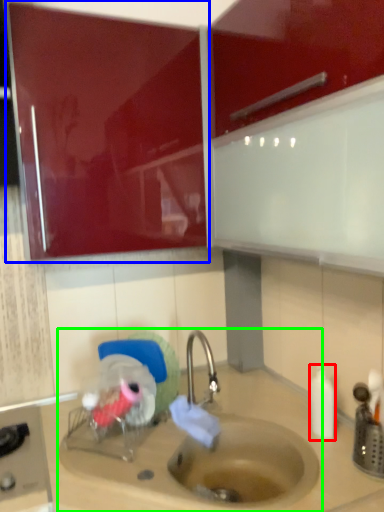
Question: Which is nearer to the bottle (highlighted by a red box)? cabinetry (highlighted by a blue box) or sink (highlighted by a green box).

Choices:
 (A) cabinetry
 (B) sink

Answer: (B)